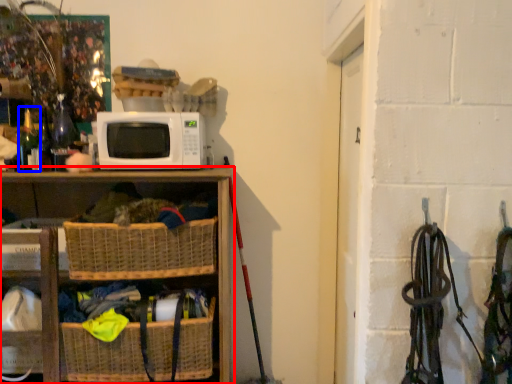
Question: Which of the following is the farthest to the observer, shelf (highlighted by a red box) or bottle (highlighted by a blue box)?

Choices:
 (A) shelf
 (B) bottle

Answer: (B)